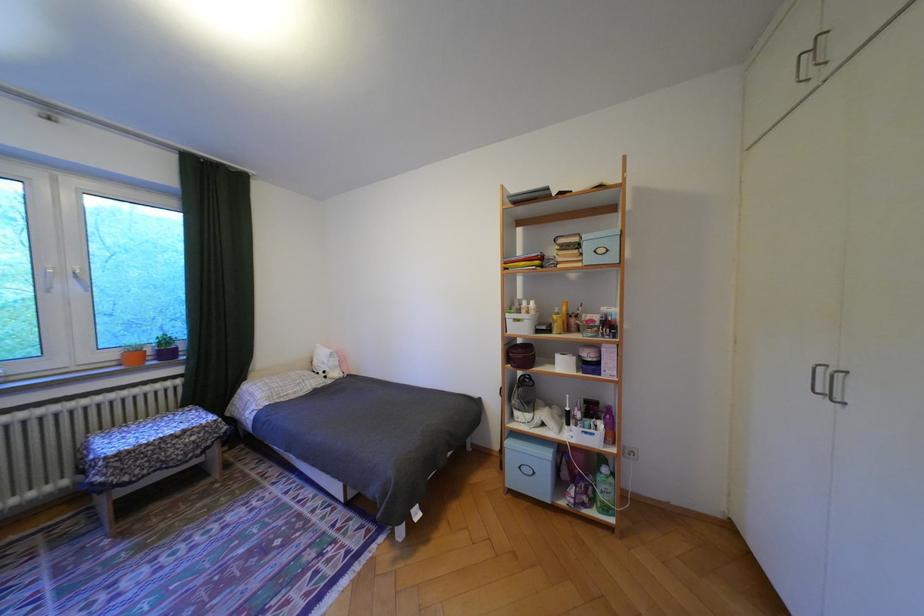
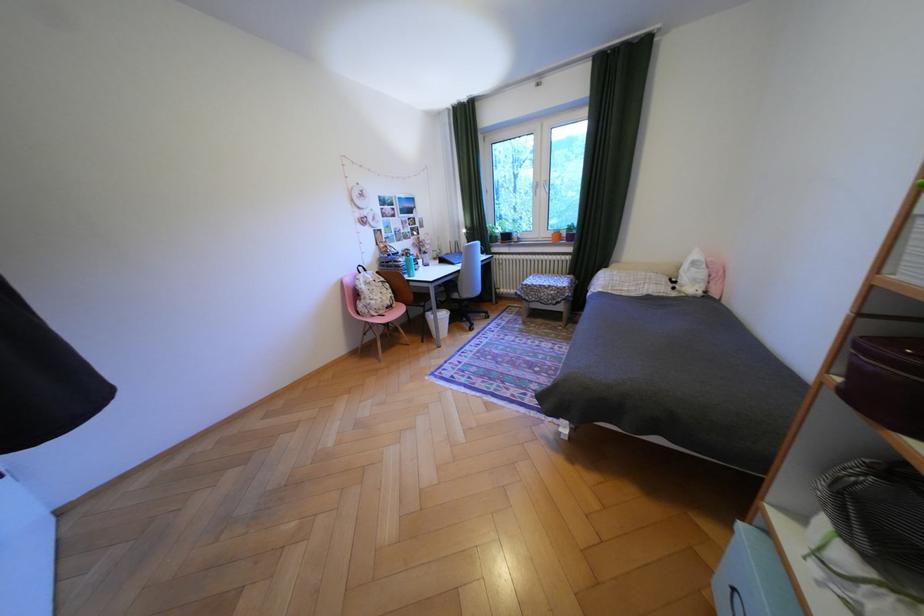
In the second image, find the point that corresponds to (x=197, y=431) in the first image.

(562, 286)